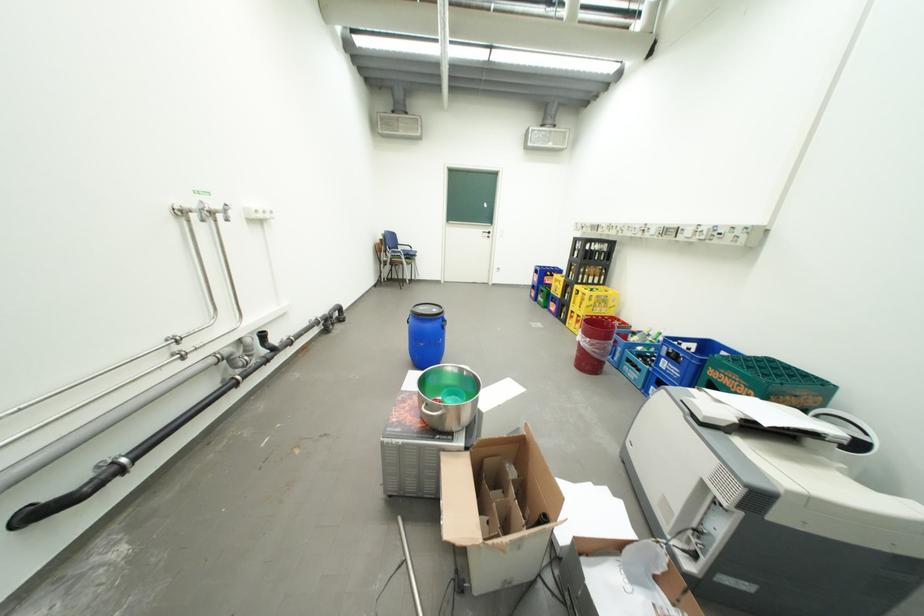
You are a GUI agent. You are given a task and a screenshot of the screen. Output one action in this format:
    pyautogui.click(x=<x>, y=<y>)
    Task: Click on the metal pot handle
    Image resolution: width=924 pixels, height=616 pixels.
    Given the screenshot: What is the action you would take?
    click(432, 408)